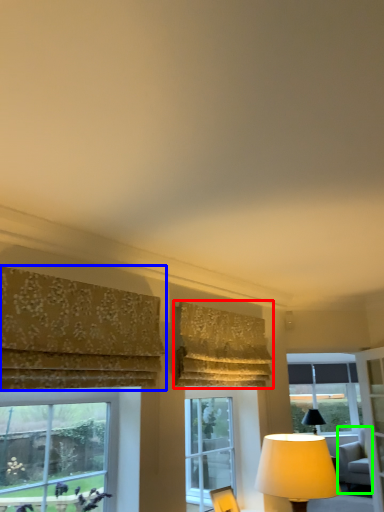
Question: Estimate the real-world distances between objects in this image. Which object is closer to curtain (highlighted by a red box), curtain (highlighted by a blue box) or swivel chair (highlighted by a green box)?

Choices:
 (A) curtain
 (B) swivel chair

Answer: (A)